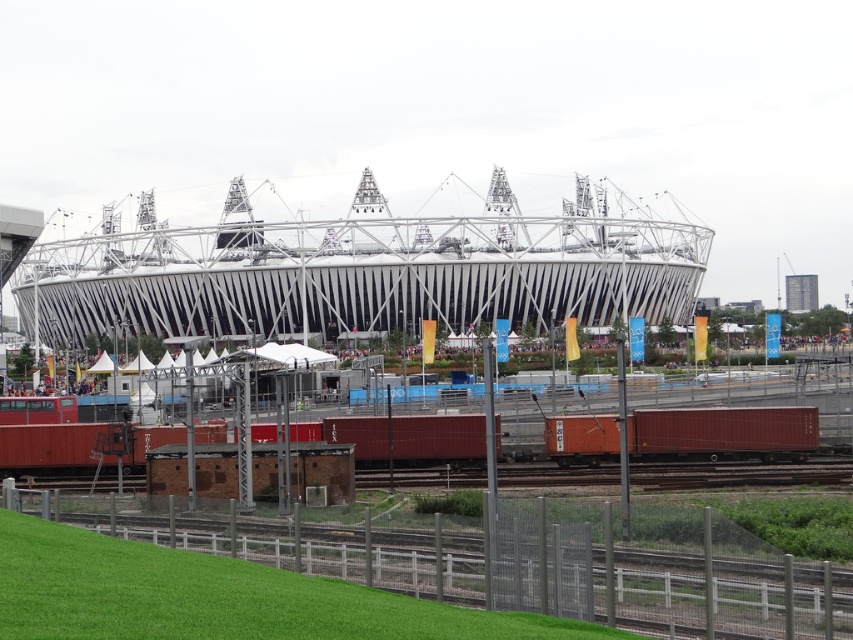
From the picture: Is green grass at lower left closer to the viewer compared to orange matte container at center?

Yes.

The image size is (853, 640). In order to click on green grass at lower left in this screenshot , I will do pyautogui.click(x=213, y=596).